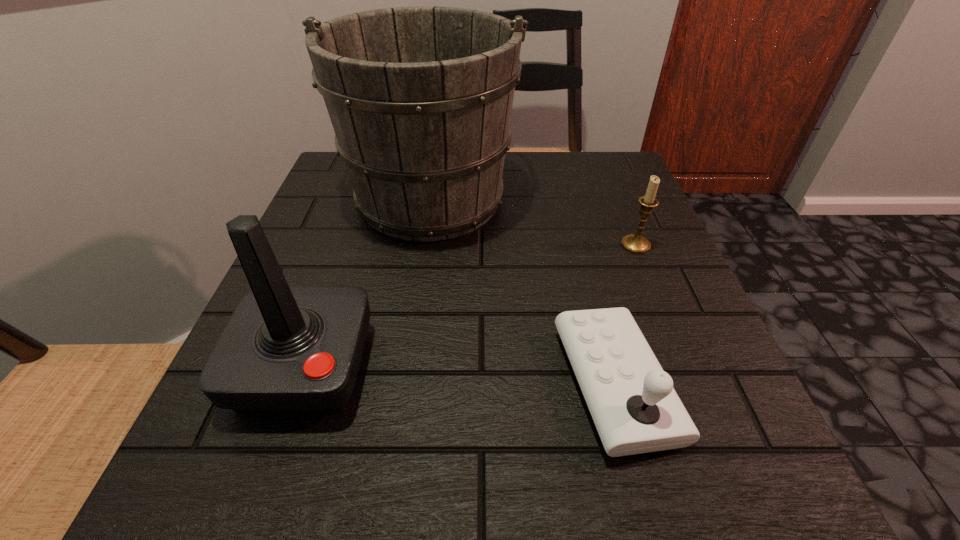
In order to click on vacant point located between the taller joystick and the tallest object in this screenshot , I will do `click(368, 281)`.

Where is `vacant space that's between the shorter joystick and the second tallest object`? The image size is (960, 540). vacant space that's between the shorter joystick and the second tallest object is located at coordinates (460, 375).

The image size is (960, 540). What are the coordinates of `vacant region between the bucket and the taller joystick` in the screenshot? It's located at (368, 281).

Where is `vacant area that lies between the rightmost object and the left joystick`? vacant area that lies between the rightmost object and the left joystick is located at coordinates (470, 306).

Locate which object ranks third in proximity to the taller joystick. Please provide its 2D coordinates. Your answer should be formatted as a tuple, i.e. [(x, y)], where the tuple contains the x and y coordinates of a point satisfying the conditions above.

[(638, 244)]

Point out which object is positioned as the second nearest to the left joystick. Please provide its 2D coordinates. Your answer should be formatted as a tuple, i.e. [(x, y)], where the tuple contains the x and y coordinates of a point satisfying the conditions above.

[(631, 399)]